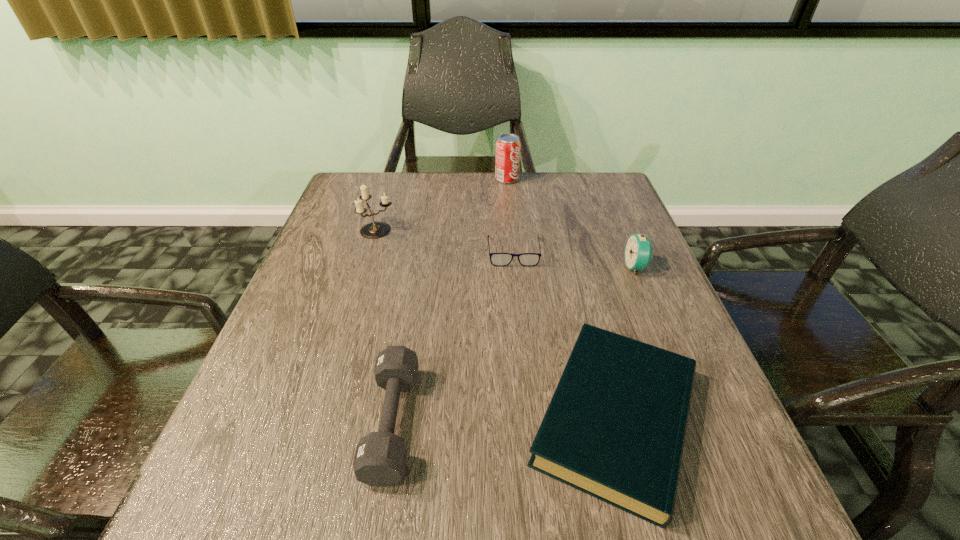
What are the coordinates of `vacant space located on the front-facing side of the fourth shortest object` in the screenshot? It's located at (532, 267).

The width and height of the screenshot is (960, 540). Find the location of `vacant space situated 0.150m on the front-facing side of the fourth shortest object`. vacant space situated 0.150m on the front-facing side of the fourth shortest object is located at coordinates (562, 267).

Identify the location of free location located on the right of the third shortest object. 593,422.

Identify the location of vacant space located 0.360m on the left of the fifth tallest object. 310,418.

Locate an element on the screen. The width and height of the screenshot is (960, 540). vacant space located on the front-facing side of the shortest object is located at coordinates (528, 403).

Locate an element on the screen. This screenshot has width=960, height=540. object that is positioned at the far edge is located at coordinates (507, 160).

Find the location of a particular element. The width and height of the screenshot is (960, 540). dumbbell present at the near edge is located at coordinates (380, 459).

Identify the location of book that is positioned at the near edge. The image size is (960, 540). (615, 427).

Locate an element on the screen. The image size is (960, 540). object positioned at the left edge is located at coordinates (374, 230).

Find the location of a particular element. The width and height of the screenshot is (960, 540). alarm clock at the right edge is located at coordinates (638, 253).